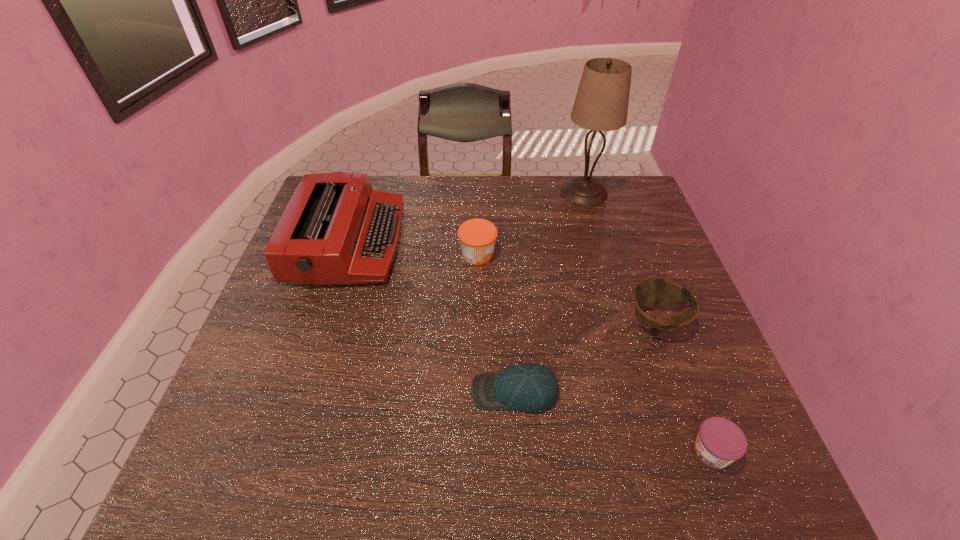
The width and height of the screenshot is (960, 540). What are the coordinates of `unoccupied position between the bowl and the third tallest object` in the screenshot? It's located at (567, 287).

Image resolution: width=960 pixels, height=540 pixels. What are the coordinates of `free space between the taller jam and the second tallest object` in the screenshot? It's located at click(x=413, y=248).

Identify the location of vacant area that lies between the lampshade and the typewriter. The image size is (960, 540). (467, 218).

The height and width of the screenshot is (540, 960). I want to click on object that stands as the third closest to the right jam, so click(477, 237).

What are the coordinates of `the third closest object to the taller jam` in the screenshot? It's located at (650, 292).

Where is `free location that satisfies the following two spatial constraints: 1. on the front-facing side of the lampshade; 2. on the typing side of the leftmost object`? This screenshot has height=540, width=960. free location that satisfies the following two spatial constraints: 1. on the front-facing side of the lampshade; 2. on the typing side of the leftmost object is located at coordinates (599, 242).

At what (x,y) coordinates should I click in order to perform the action: click on blank area in the image that satisfies the following two spatial constraints: 1. on the back side of the fourth farthest object; 2. on the typing side of the leftmost object. Please return your answer as a coordinate pair (x, y). Looking at the image, I should click on (629, 242).

Identify the location of free space that satisfies the following two spatial constraints: 1. on the front label of the second nearest object; 2. on the left side of the left jam. Image resolution: width=960 pixels, height=540 pixels. (477, 392).

Image resolution: width=960 pixels, height=540 pixels. I want to click on vacant space that satisfies the following two spatial constraints: 1. on the front label of the third tallest object; 2. on the right side of the third nearest object, so click(x=477, y=320).

Locate an element on the screen. free space that satisfies the following two spatial constraints: 1. on the front label of the left jam; 2. on the back side of the fourth farthest object is located at coordinates (477, 320).